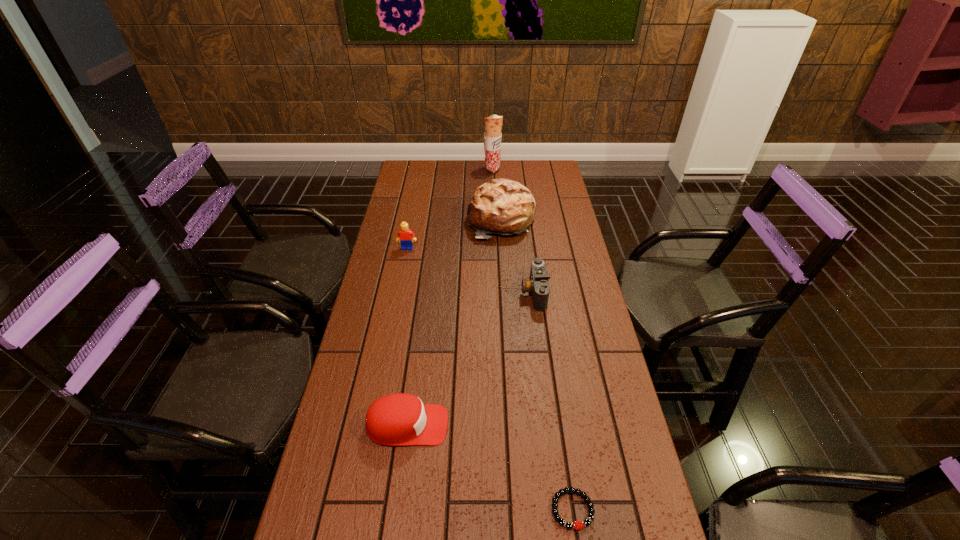
At what (x,y) coordinates should I click in order to perform the action: click on burrito. Please return your answer as a coordinate pair (x, y). Looking at the image, I should click on (493, 124).

The image size is (960, 540). I want to click on the tallest object, so click(x=493, y=124).

Locate an element on the screen. the second farthest object is located at coordinates (502, 206).

At what (x,y) coordinates should I click in order to perform the action: click on bread. Please return your answer as a coordinate pair (x, y). This screenshot has height=540, width=960. Looking at the image, I should click on (502, 206).

Find the location of a particular element. the fourth shortest object is located at coordinates (405, 236).

At what (x,y) coordinates should I click in order to perform the action: click on the fourth nearest object. Please return your answer as a coordinate pair (x, y). The image size is (960, 540). Looking at the image, I should click on (405, 236).

What are the coordinates of `camera` in the screenshot? It's located at 538,284.

I want to click on the fifth farthest object, so click(x=400, y=419).

You are a GUI agent. You are given a task and a screenshot of the screen. Output one action in this format:
    pyautogui.click(x=<x>, y=<y>)
    Task: Click on the shortest object
    This screenshot has height=540, width=960.
    Given the screenshot: What is the action you would take?
    pyautogui.click(x=577, y=525)

Locate an element on the screen. This screenshot has height=540, width=960. bracelet is located at coordinates (577, 525).